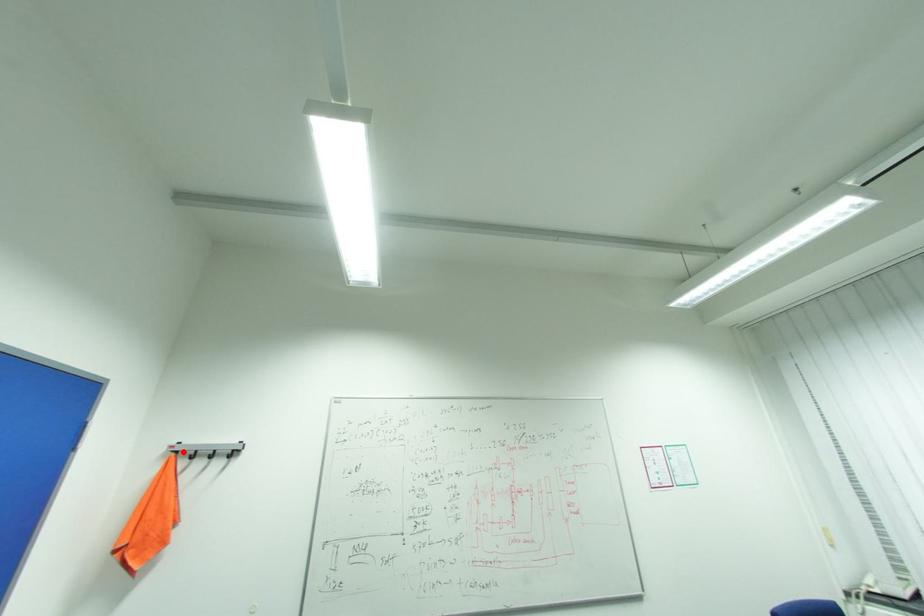
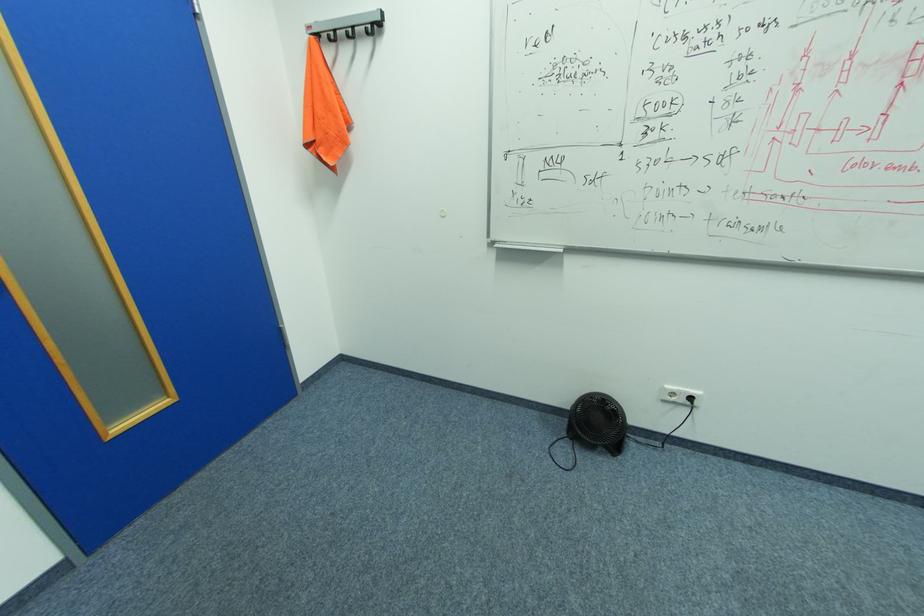
Question: I am providing you with two images of the same scene from different viewpoints. A red point is marked on the first image. At the location where the point appears in image 1, is it still visible in image 2?

Choices:
 (A) Yes
 (B) No

Answer: (A)